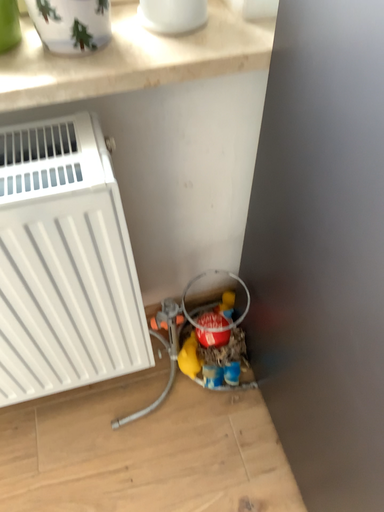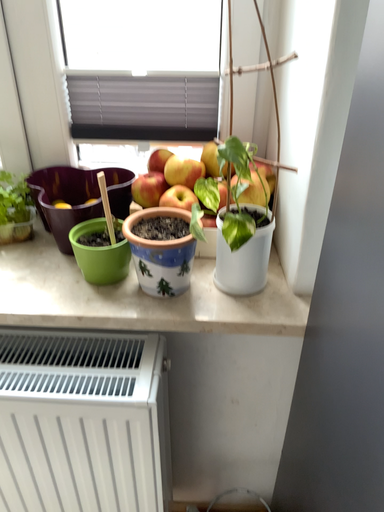
Question: Which way did the camera rotate in the video?

Choices:
 (A) rotated upward
 (B) rotated downward

Answer: (A)